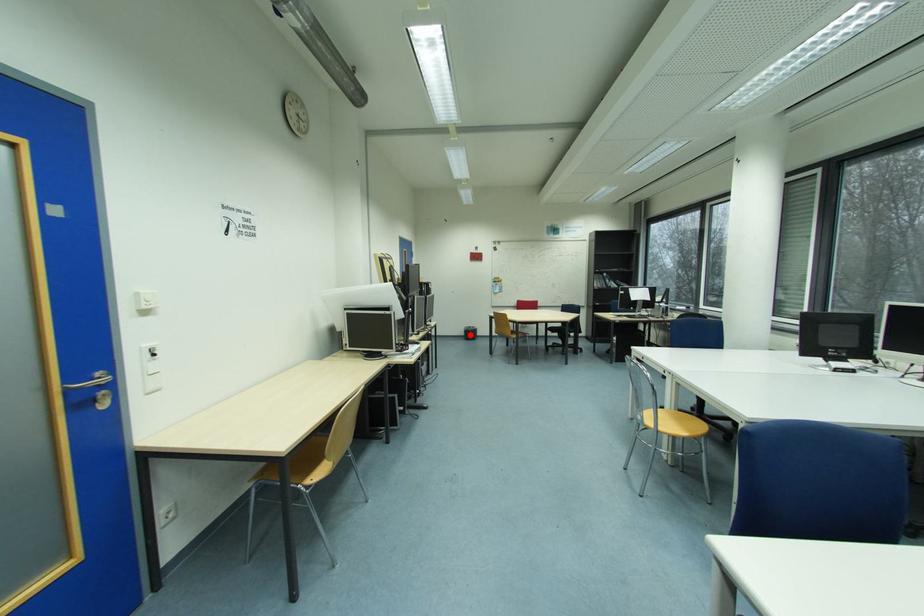
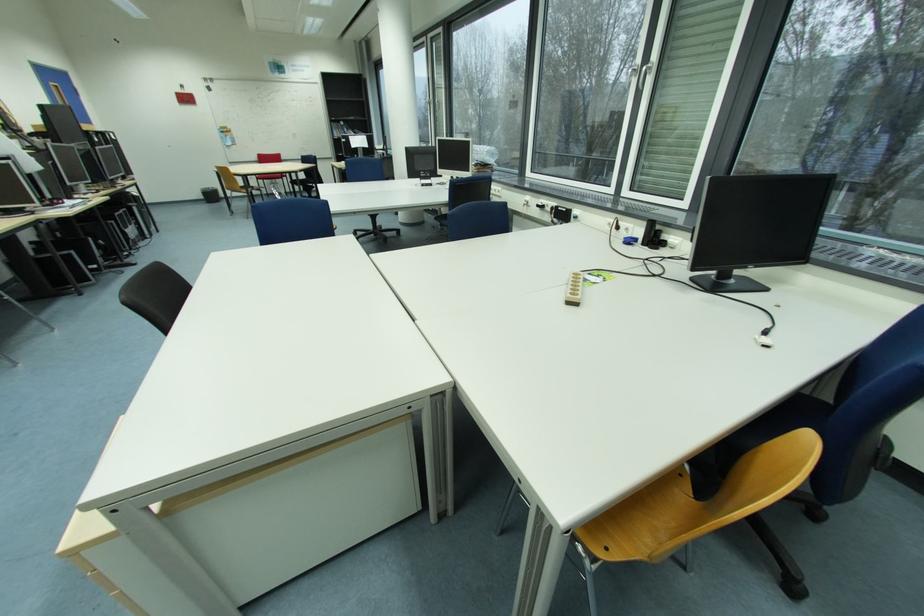
Question: I am providing you with two images of the same scene from different viewpoints. A red point is shown in image1. For the corresponding object point in image2, is it positioned nearer or farther from the camera?

Choices:
 (A) Nearer
 (B) Farther

Answer: (A)